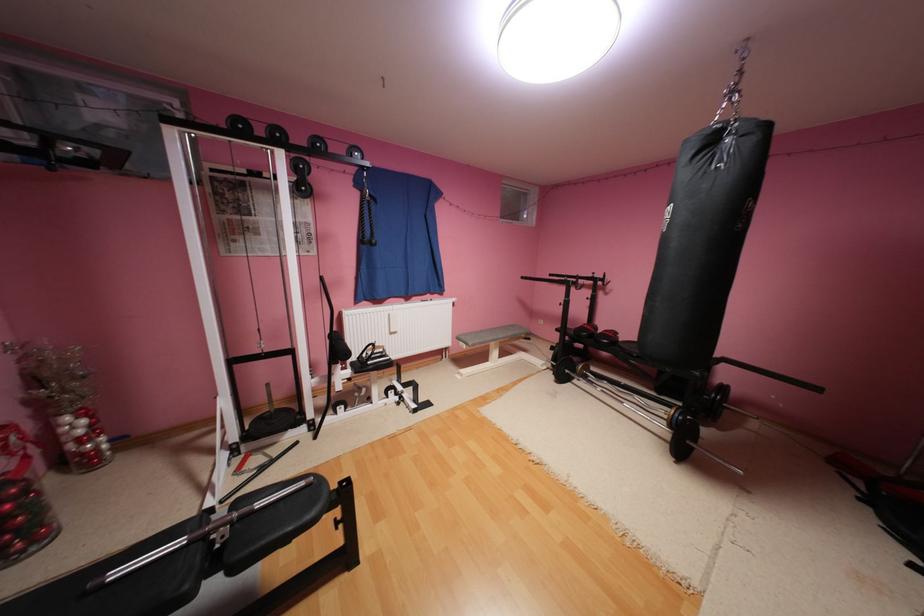
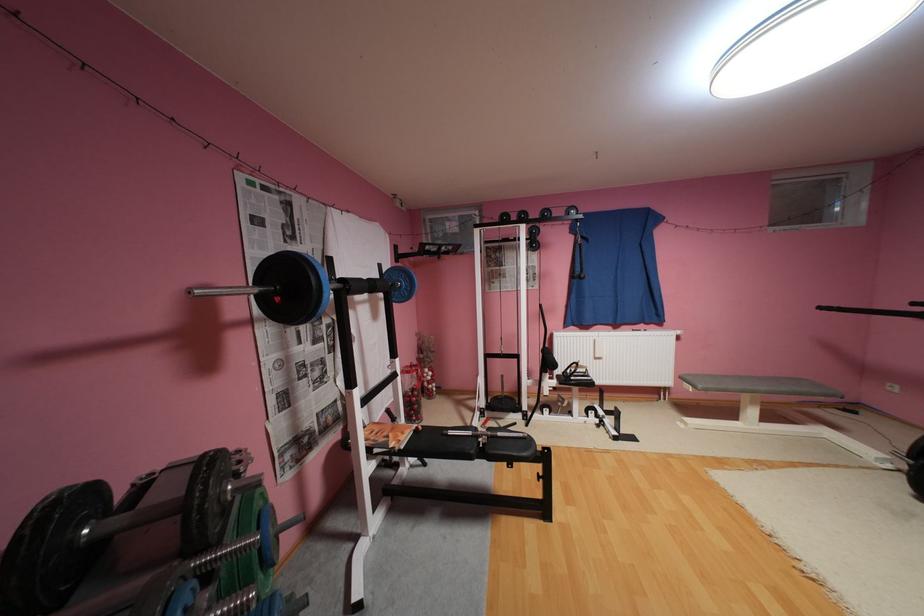
Find the pixel in the second image that matches (x=496, y=361) in the first image.

(746, 419)